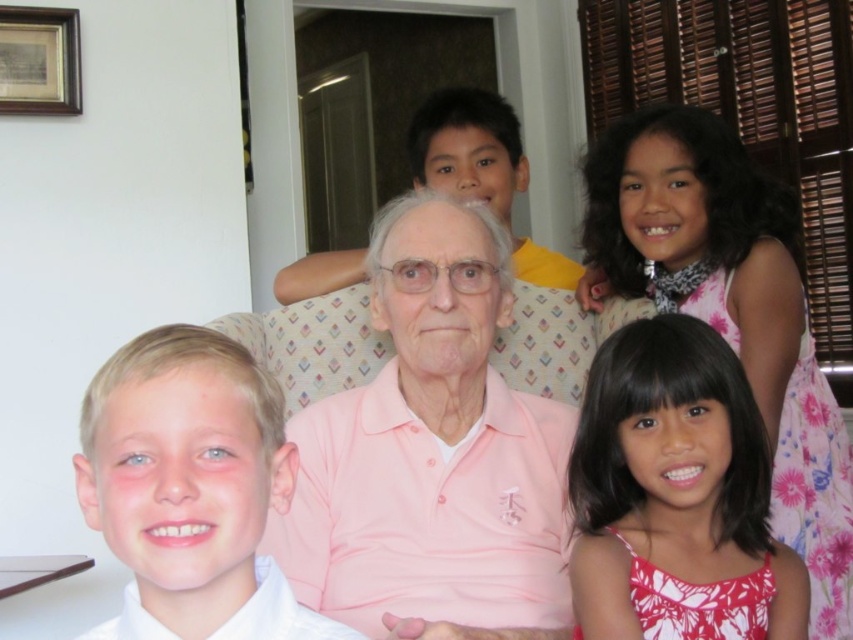
You are a photographer setting up for a family photo. You need to ensure that the pink cotton shirt at center and the blonde hair boy at left are both visible in the frame. Considering their sizes, which one might require more space in the composition?

The pink cotton shirt at center requires more space in the composition because its width is larger than the blonde hair boy at left.